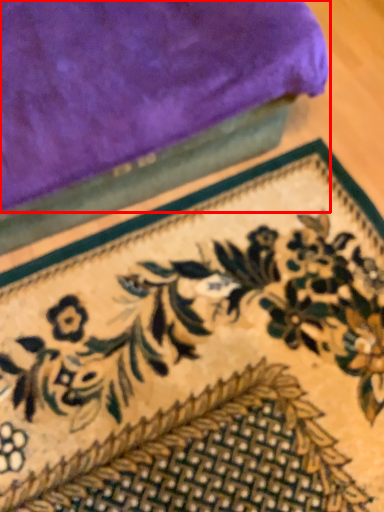
Question: From the image's perspective, considering the relative positions of towel (annotated by the red box) and mat in the image provided, where is towel (annotated by the red box) located with respect to the staircase?

Choices:
 (A) above
 (B) below

Answer: (A)